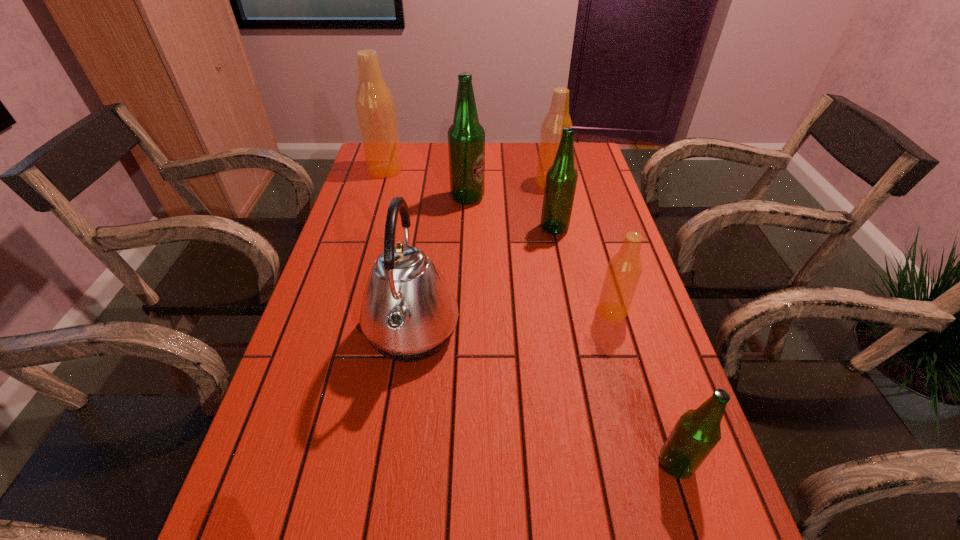
This screenshot has height=540, width=960. Identify the location of the leftmost green beer bottle. (466, 137).

You are a GUI agent. You are given a task and a screenshot of the screen. Output one action in this format:
    pyautogui.click(x=<x>, y=<y>)
    Task: Click on the biggest green beer bottle
    The width and height of the screenshot is (960, 540).
    Given the screenshot: What is the action you would take?
    pyautogui.click(x=466, y=137)

This screenshot has width=960, height=540. I want to click on the leftmost object, so click(374, 103).

Locate an element on the screen. The height and width of the screenshot is (540, 960). the leftmost tan beer bottle is located at coordinates coord(374,103).

Where is `kettle`? kettle is located at coordinates (408, 313).

Locate an element on the screen. The image size is (960, 540). the second smallest tan beer bottle is located at coordinates (558, 117).

The height and width of the screenshot is (540, 960). Identify the location of the second green beer bottle from right to left. (561, 179).

Where is `the second smallest green beer bottle`? The height and width of the screenshot is (540, 960). the second smallest green beer bottle is located at coordinates (561, 179).

You are a GUI agent. You are given a task and a screenshot of the screen. Output one action in this format:
    pyautogui.click(x=<x>, y=<y>)
    Task: Click on the smallest green beer bottle
    Image resolution: width=960 pixels, height=540 pixels.
    Given the screenshot: What is the action you would take?
    pyautogui.click(x=697, y=432)

Identify the location of the nearest green beer bottle. coord(697,432).